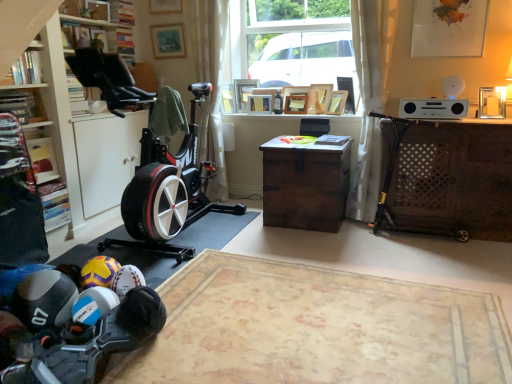
Find the location of a particular element. The height and width of the screenshot is (384, 512). free space between rubberized black dumbbells at lower left and white sheer curtain at right, arranged as the first curtain when viewed from the right is located at coordinates [x=257, y=280].